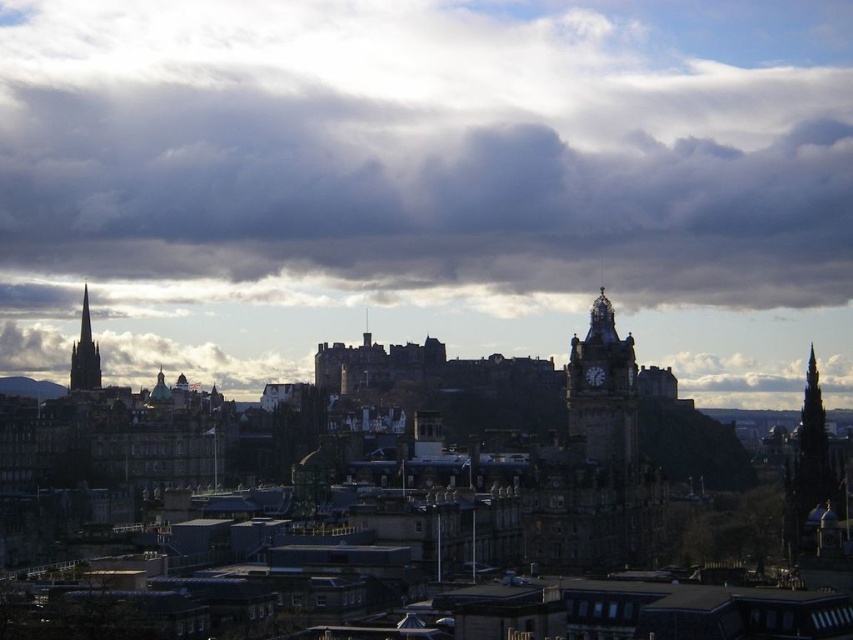
Is cloudy sky at upper center further to camera compared to stone clock tower at center?

Yes, cloudy sky at upper center is behind stone clock tower at center.

Can you confirm if cloudy sky at upper center is shorter than stone clock tower at center?

No.

Locate an element on the screen. The height and width of the screenshot is (640, 853). cloudy sky at upper center is located at coordinates (428, 180).

This screenshot has height=640, width=853. I want to click on cloudy sky at upper center, so click(x=428, y=180).

Is cloudy sky at upper center positioned at the back of dark brown stone spire at left?

No, cloudy sky at upper center is closer to the viewer.

Is cloudy sky at upper center bigger than dark brown stone spire at left?

Indeed, cloudy sky at upper center has a larger size compared to dark brown stone spire at left.

Between point (372, 38) and point (83, 380), which one is positioned in front?

Point (83, 380) is more forward.

At what (x,y) coordinates should I click in order to perform the action: click on cloudy sky at upper center. Please return your answer as a coordinate pair (x, y). Looking at the image, I should click on (428, 180).

Who is positioned more to the left, stone clock tower at center or dark brown stone spire at left?

dark brown stone spire at left

From the picture: Can you confirm if stone clock tower at center is smaller than dark brown stone spire at left?

Correct, stone clock tower at center occupies less space than dark brown stone spire at left.

What do you see at coordinates (602, 388) in the screenshot? I see `stone clock tower at center` at bounding box center [602, 388].

At what (x,y) coordinates should I click in order to perform the action: click on stone clock tower at center. Please return your answer as a coordinate pair (x, y). The image size is (853, 640). Looking at the image, I should click on (602, 388).